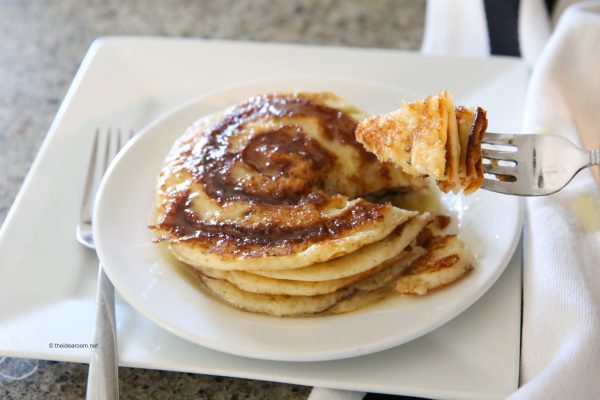
Identify the location of square plate. (57, 312).